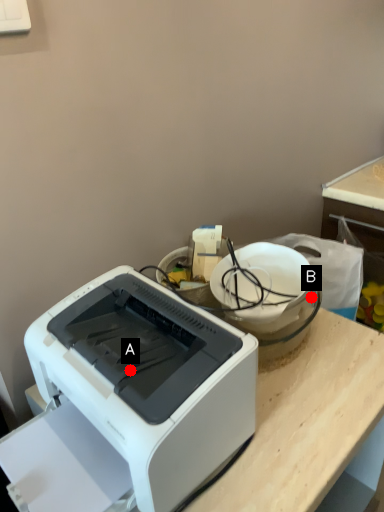
Question: Two points are circled on the image, labeled by A and B beside each circle. Which of the following is the farthest from the observer?

Choices:
 (A) A is further
 (B) B is further

Answer: (B)